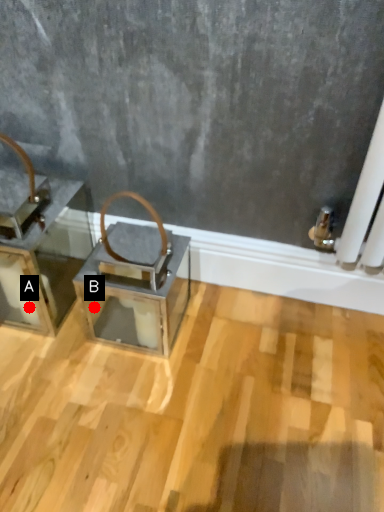
Question: Two points are circled on the image, labeled by A and B beside each circle. Among these points, which one is farthest from the camera?

Choices:
 (A) A is further
 (B) B is further

Answer: (B)